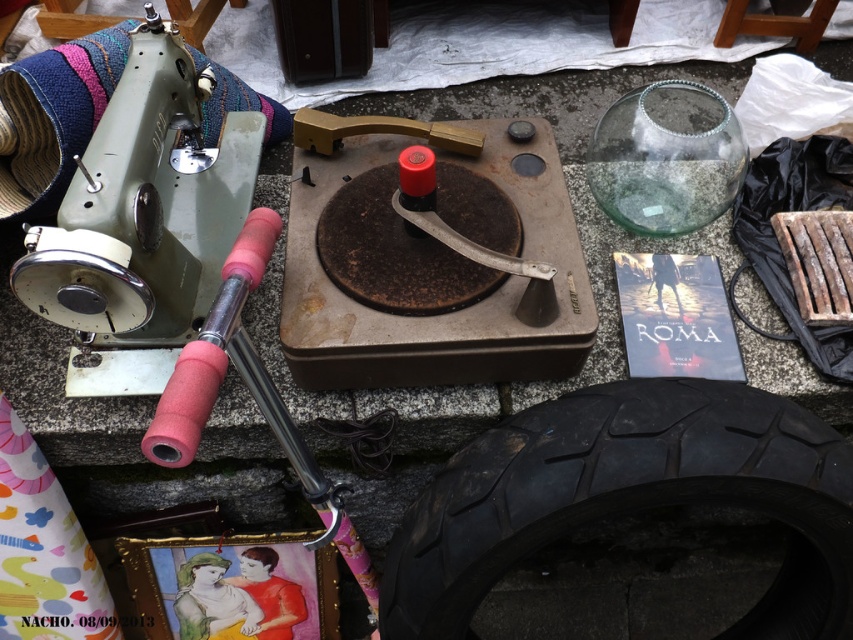
You are standing at the center of the stone surface where the items are displayed. If you face the direction of the matte green sewing machine at left, which direction should you turn to look towards the record player next to it?

The record player is next to the matte green sewing machine at left, so you should turn slightly to your right to face the record player.

You are a customer at the flea market and want to place a small basket between the black rubber tire at bottom right and the matte green sewing machine at left. Based on their positions, where should you place the basket?

The black rubber tire at bottom right is to the right of the matte green sewing machine at left, so you should place the basket between them, closer to the center of the two objects.

You are setting up a display at an outdoor market and need to arrange the black rubber tire at bottom right and the pink foam hammer at upper left. According to the scene, which object should be placed lower to ensure stability?

The black rubber tire at bottom right should be placed lower because it is taller than the pink foam hammer at upper left, making it more stable at a lower position.